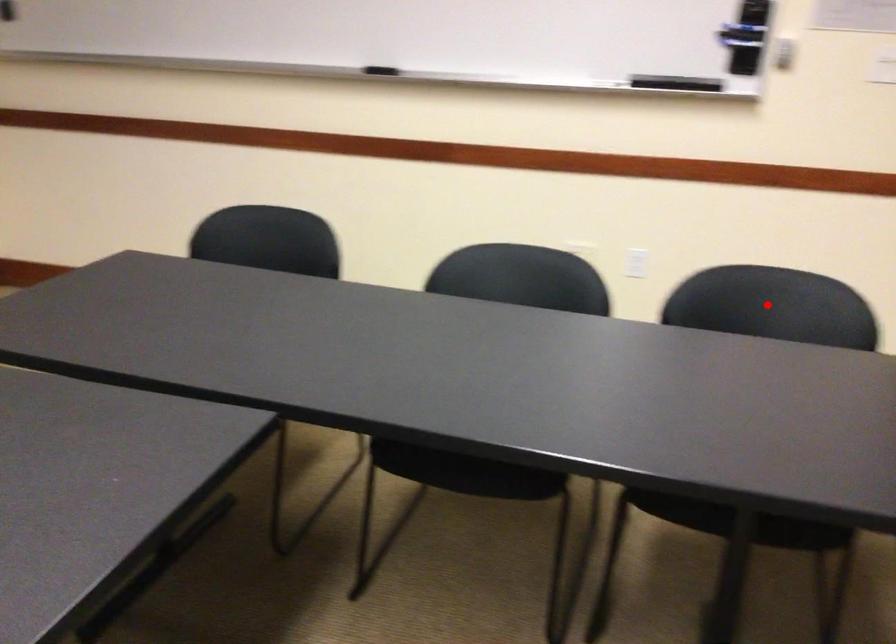
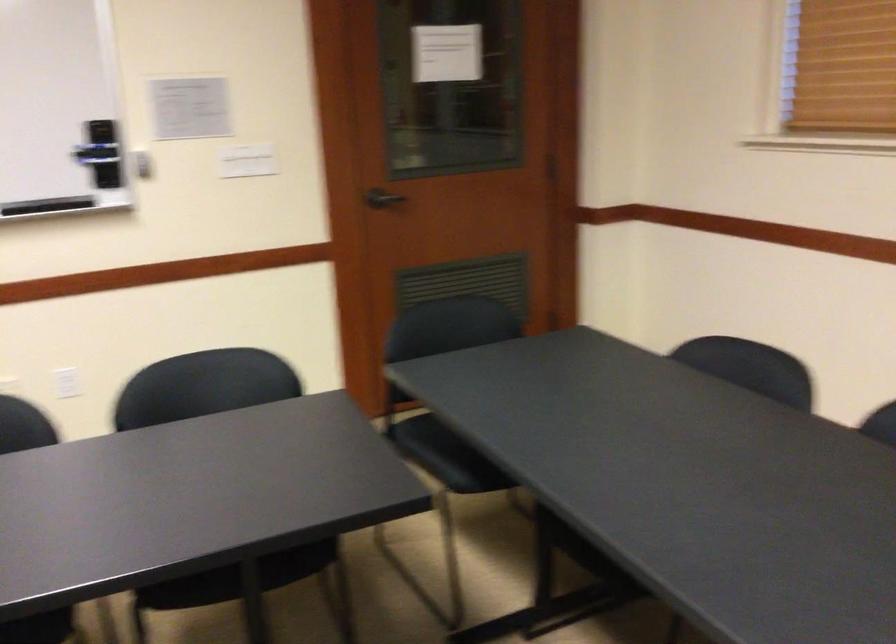
Question: I am providing you with two images of the same scene from different viewpoints. Given a red point in image1, look at the same physical point in image2. Is it:

Choices:
 (A) Closer to the viewpoint
 (B) Farther from the viewpoint

Answer: (B)